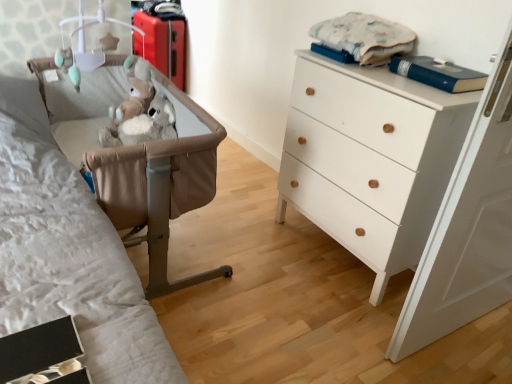
Identify the location of vacant space to the left of white wood chest of drawers at right. Image resolution: width=512 pixels, height=384 pixels. (254, 242).